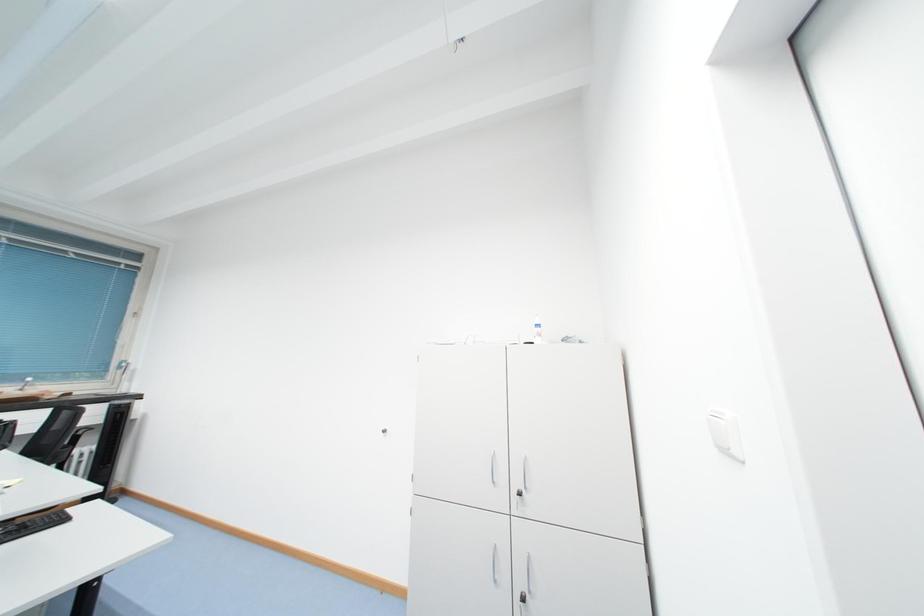
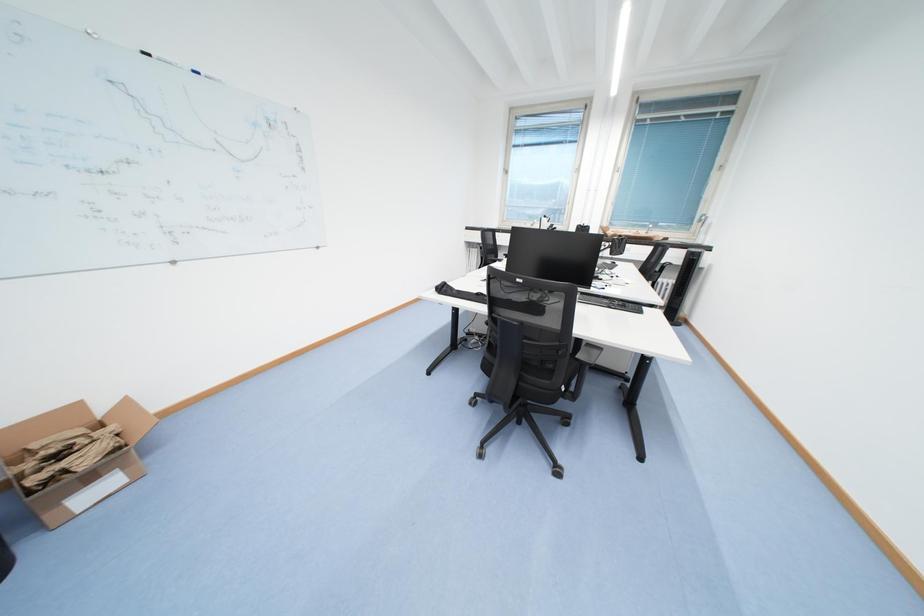
In the scene shown: How did the camera likely rotate?

The camera's rotation is toward left-down.